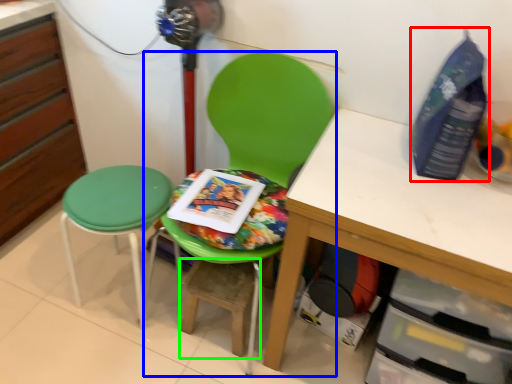
Question: Which is farther away from bottle (highlighted by a red box)? chair (highlighted by a blue box) or step stool (highlighted by a green box)?

Choices:
 (A) chair
 (B) step stool

Answer: (B)